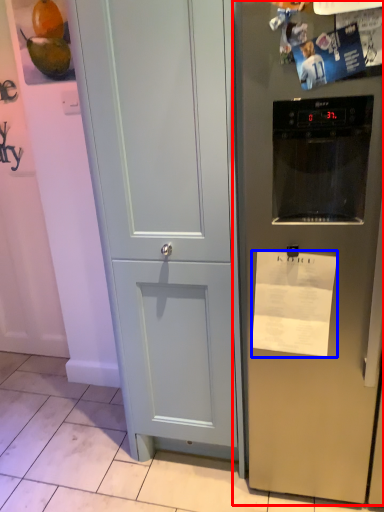
Question: Which point is closer to the camera, refrigerator (highlighted by a red box) or paper (highlighted by a blue box)?

Choices:
 (A) refrigerator
 (B) paper

Answer: (A)